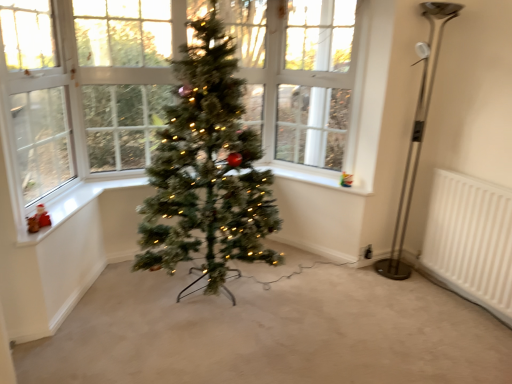
Question: From the image's perspective, is green artificial christmas tree at center located beneath white painted wood at lower left, which ranks as the 2th window sill in right-to-left order?

Choices:
 (A) no
 (B) yes

Answer: (A)

Question: Is green artificial christmas tree at center far away from white painted wood at lower left, the second window sill from the back?

Choices:
 (A) no
 (B) yes

Answer: (A)

Question: Does green artificial christmas tree at center have a greater width compared to white painted wood at lower left, which ranks as the 2th window sill in right-to-left order?

Choices:
 (A) no
 (B) yes

Answer: (B)

Question: Is green artificial christmas tree at center directly adjacent to white painted wood at lower left, which appears as the first window sill when viewed from the front?

Choices:
 (A) yes
 (B) no

Answer: (B)

Question: Does green artificial christmas tree at center contain white painted wood at lower left, which is the 1th window sill from left to right?

Choices:
 (A) yes
 (B) no

Answer: (B)

Question: Is green artificial christmas tree at center positioned behind white painted wood at lower left, the second window sill from the back?

Choices:
 (A) yes
 (B) no

Answer: (B)

Question: Is polished metal floor lamp at right facing away from clear glass window at upper center, the second window screen positioned from the left?

Choices:
 (A) no
 (B) yes

Answer: (A)

Question: Can clear glass window at upper center, which appears as the first window screen when viewed from the back, be found inside polished metal floor lamp at right?

Choices:
 (A) no
 (B) yes

Answer: (A)

Question: From a real-world perspective, is polished metal floor lamp at right beneath clear glass window at upper center, which appears as the first window screen when viewed from the back?

Choices:
 (A) yes
 (B) no

Answer: (A)

Question: Is polished metal floor lamp at right positioned behind clear glass window at upper center, the first window screen positioned from the right?

Choices:
 (A) yes
 (B) no

Answer: (B)

Question: From the image's perspective, is polished metal floor lamp at right above clear glass window at upper center, the first window screen positioned from the right?

Choices:
 (A) yes
 (B) no

Answer: (B)

Question: From the image's perspective, is polished metal floor lamp at right under clear glass window at upper center, which appears as the first window screen when viewed from the back?

Choices:
 (A) yes
 (B) no

Answer: (A)

Question: Is clear glass window at left, which is the second window screen in back-to-front order, in contact with polished metal floor lamp at right?

Choices:
 (A) yes
 (B) no

Answer: (B)